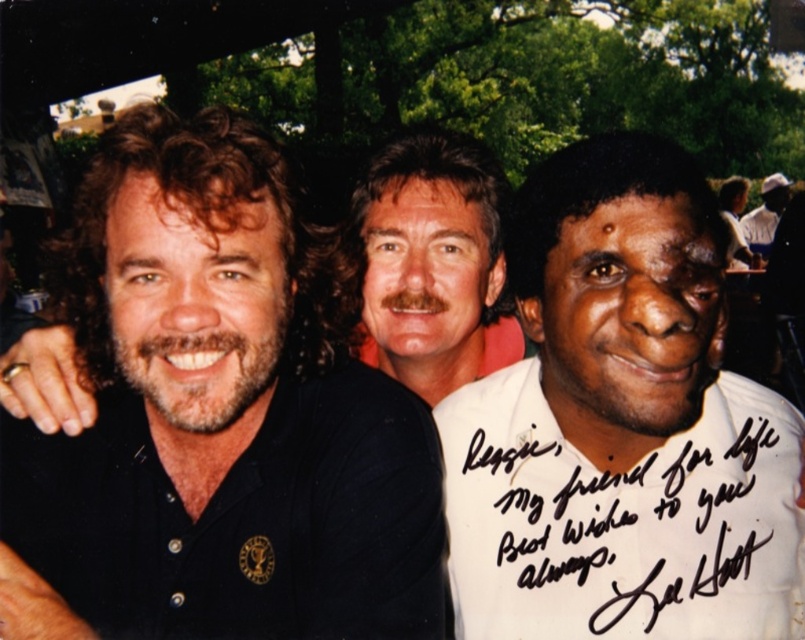
You are a photographer at the event and want to ensure that both the black cotton polo shirt at left and the white cotton shirt at upper right are clearly visible in the photo. Which shirt should you focus on first to ensure depth of field captures both?

The black cotton polo shirt at left is located below the white cotton shirt at upper right. To ensure both are in focus, focus on the white cotton shirt at upper right since it is closer to the camera, allowing the depth of field to extend backward to the black cotton polo shirt at left.